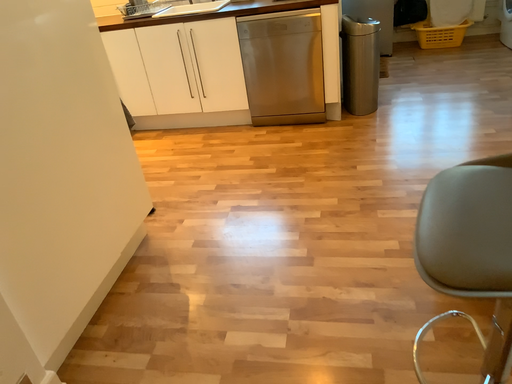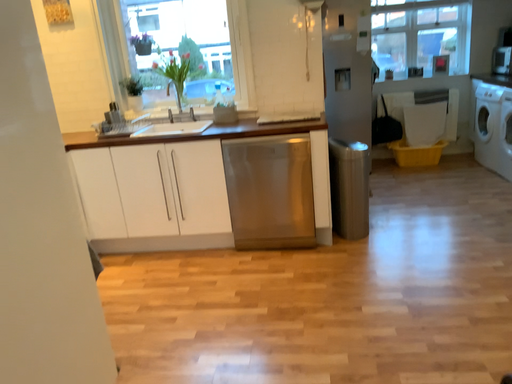
Question: Which way did the camera rotate in the video?

Choices:
 (A) rotated upward
 (B) rotated downward

Answer: (A)